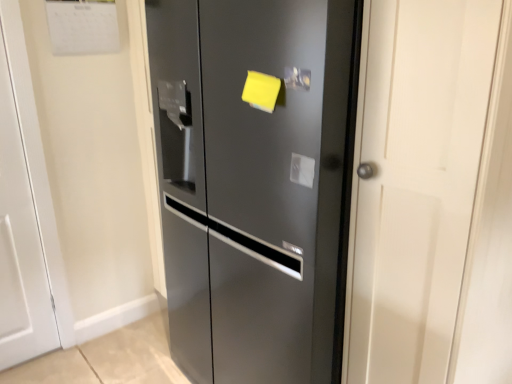
Question: From a real-world perspective, is white matte door at left, which is counted as the first door, starting from the left, on top of satin black refrigerator at center, which is the first door in right-to-left order?

Choices:
 (A) no
 (B) yes

Answer: (A)

Question: Is white matte door at left, which is counted as the first door, starting from the left, facing towards satin black refrigerator at center, which is the first door in right-to-left order?

Choices:
 (A) yes
 (B) no

Answer: (B)

Question: Is white matte door at left, which is counted as the first door, starting from the left, in front of satin black refrigerator at center, which ranks as the 2th door in left-to-right order?

Choices:
 (A) no
 (B) yes

Answer: (A)

Question: Would you consider white matte door at left, positioned as the 2th door in right-to-left order, to be distant from satin black refrigerator at center, which is the first door in right-to-left order?

Choices:
 (A) no
 (B) yes

Answer: (A)

Question: From a real-world perspective, is white matte door at left, which is counted as the first door, starting from the left, positioned under satin black refrigerator at center, which ranks as the 2th door in left-to-right order, based on gravity?

Choices:
 (A) no
 (B) yes

Answer: (B)

Question: Would you say white matte door at left, positioned as the 2th door in right-to-left order, is outside satin black refrigerator at center, which ranks as the 2th door in left-to-right order?

Choices:
 (A) yes
 (B) no

Answer: (A)

Question: Is white matte door at left, which is counted as the first door, starting from the left, completely or partially inside satin black refrigerator at center, which ranks as the 2th door in left-to-right order?

Choices:
 (A) yes
 (B) no

Answer: (B)

Question: From a real-world perspective, is satin black refrigerator at center, which is the first door in right-to-left order, on top of white matte door at left, positioned as the 2th door in right-to-left order?

Choices:
 (A) no
 (B) yes

Answer: (B)

Question: Does satin black refrigerator at center, which ranks as the 2th door in left-to-right order, have a lesser width compared to white matte door at left, positioned as the 2th door in right-to-left order?

Choices:
 (A) yes
 (B) no

Answer: (B)

Question: Can you confirm if satin black refrigerator at center, which ranks as the 2th door in left-to-right order, is wider than white matte door at left, positioned as the 2th door in right-to-left order?

Choices:
 (A) no
 (B) yes

Answer: (B)

Question: Is satin black refrigerator at center, which is the first door in right-to-left order, smaller than white matte door at left, positioned as the 2th door in right-to-left order?

Choices:
 (A) yes
 (B) no

Answer: (B)

Question: Is satin black refrigerator at center, which is the first door in right-to-left order, bigger than white matte door at left, which is counted as the first door, starting from the left?

Choices:
 (A) no
 (B) yes

Answer: (B)

Question: From their relative heights in the image, would you say satin black refrigerator at center, which ranks as the 2th door in left-to-right order, is taller or shorter than white matte door at left, which is counted as the first door, starting from the left?

Choices:
 (A) short
 (B) tall

Answer: (B)